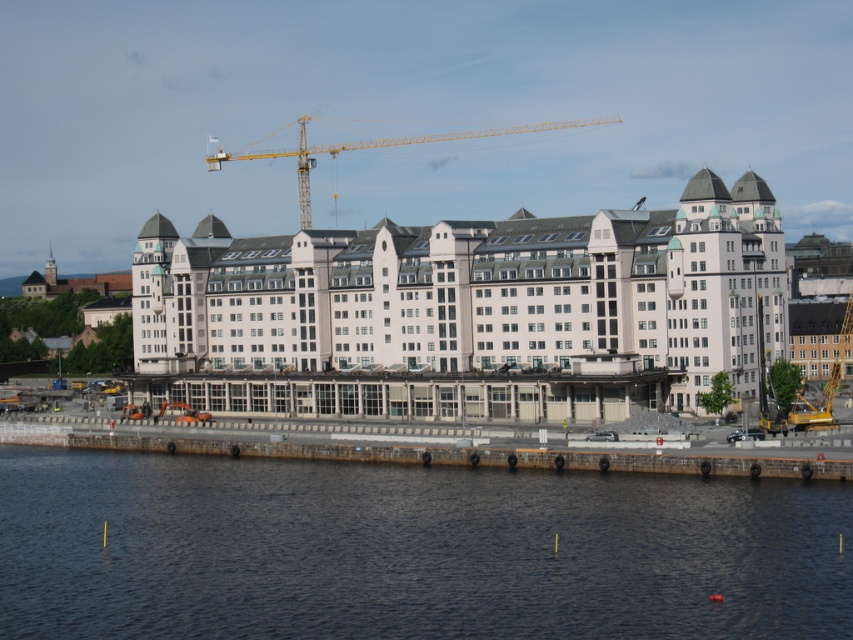
Does white smooth building at center appear over yellow metallic crane at center?

Incorrect, white smooth building at center is not positioned above yellow metallic crane at center.

Identify the location of white smooth building at center. (469, 310).

Identify the location of white smooth building at center. tap(469, 310).

In the scene shown: Can you confirm if dark blue water at lower center is smaller than white smooth building at center?

Indeed, dark blue water at lower center has a smaller size compared to white smooth building at center.

Based on the photo, between dark blue water at lower center and white smooth building at center, which one is positioned lower?

Positioned lower is dark blue water at lower center.

At what (x,y) coordinates should I click in order to perform the action: click on dark blue water at lower center. Please return your answer as a coordinate pair (x, y). Looking at the image, I should click on (410, 550).

The image size is (853, 640). In order to click on dark blue water at lower center in this screenshot , I will do `click(410, 550)`.

Is dark blue water at lower center behind yellow metallic crane at center?

No, it is in front of yellow metallic crane at center.

Between point (424, 628) and point (299, 156), which one is positioned behind?

Point (299, 156)

Locate an element on the screen. The height and width of the screenshot is (640, 853). dark blue water at lower center is located at coordinates click(x=410, y=550).